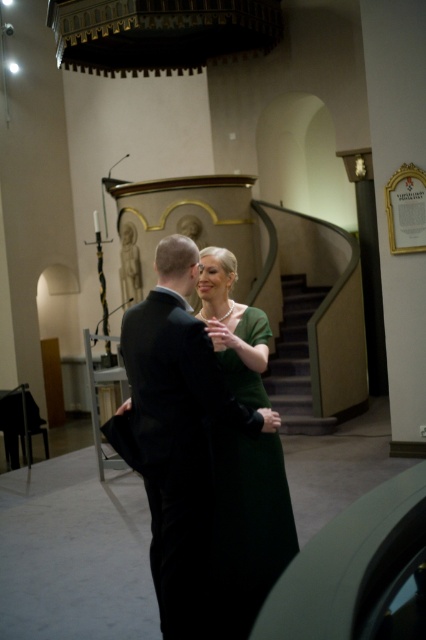
You are an event planner organizing a small gathering in the church. You need to place a 3D printed model of the green matte dress at center on a table near the wooden staircase at center. Given their sizes, will the dress model fit on the table next to the staircase?

The green matte dress at center occupies less space than the wooden staircase at center. Therefore, the 3D printed model of the green matte dress at center should fit on the table next to the wooden staircase at center since it is smaller in size.